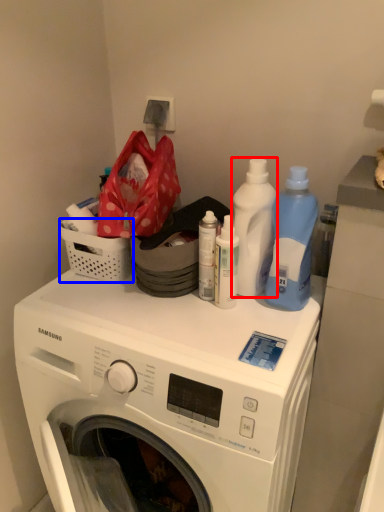
Question: Which object is closer to the camera taking this photo, cleaning product (highlighted by a red box) or basket (highlighted by a blue box)?

Choices:
 (A) cleaning product
 (B) basket

Answer: (A)